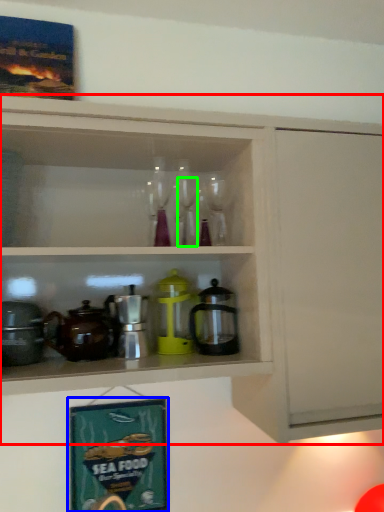
Question: Based on their relative distances, which object is farther from cabinetry (highlighted by a red box)? Choose from picture frame (highlighted by a blue box) and wine glass (highlighted by a green box).

Choices:
 (A) picture frame
 (B) wine glass

Answer: (A)